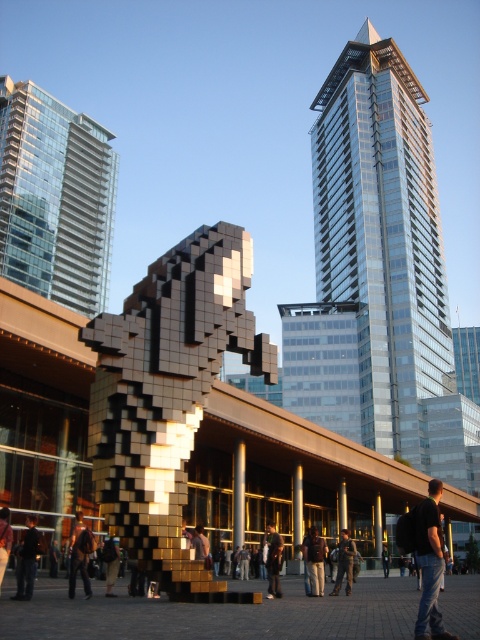
Question: Can you confirm if gold metallic pixelated sculpture at center is wider than black backpack at lower right?

Choices:
 (A) no
 (B) yes

Answer: (A)

Question: Which point is closer to the camera taking this photo?

Choices:
 (A) (436, 580)
 (B) (156, 456)
 (C) (316, 561)
 (D) (278, 557)

Answer: (A)

Question: Which of the following is the closest to the observer?

Choices:
 (A) (201, 236)
 (B) (421, 134)
 (C) (271, 529)
 (D) (22, 186)

Answer: (A)

Question: Is gold metallic pixelated sculpture at center closer to camera compared to dark gray fabric jacket at center?

Choices:
 (A) yes
 (B) no

Answer: (A)

Question: Which of the following is the closest to the observer?

Choices:
 (A) dark brown leather jacket at center
 (B) glassy reflective skyscraper at upper left

Answer: (A)

Question: Is glassy metallic skyscraper at upper right to the left of black backpack at lower right from the viewer's perspective?

Choices:
 (A) no
 (B) yes

Answer: (A)